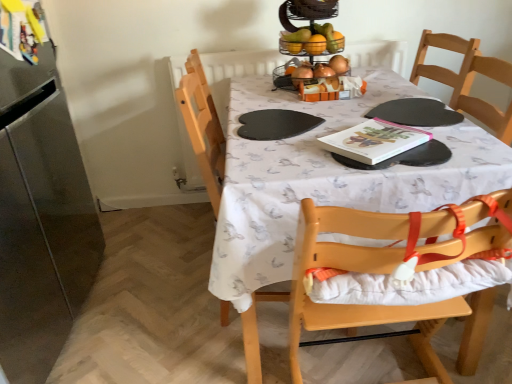
Question: Can you confirm if shiny metallic fruit basket at upper center is bigger than light wood highchair at center?

Choices:
 (A) yes
 (B) no

Answer: (B)

Question: Does shiny metallic fruit basket at upper center turn towards light wood highchair at center?

Choices:
 (A) yes
 (B) no

Answer: (B)

Question: Does shiny metallic fruit basket at upper center have a lesser height compared to light wood highchair at center?

Choices:
 (A) yes
 (B) no

Answer: (A)

Question: Is shiny metallic fruit basket at upper center behind light wood highchair at center?

Choices:
 (A) yes
 (B) no

Answer: (A)

Question: Is the depth of shiny metallic fruit basket at upper center less than that of light wood highchair at center?

Choices:
 (A) yes
 (B) no

Answer: (B)

Question: Is shiny metallic fruit basket at upper center oriented away from light wood highchair at center?

Choices:
 (A) yes
 (B) no

Answer: (B)

Question: Is stainless steel refrigerator at left further to camera compared to white printed tablecloth at center?

Choices:
 (A) no
 (B) yes

Answer: (A)

Question: From a real-world perspective, is stainless steel refrigerator at left over white printed tablecloth at center?

Choices:
 (A) yes
 (B) no

Answer: (A)

Question: Does stainless steel refrigerator at left appear on the right side of white printed tablecloth at center?

Choices:
 (A) no
 (B) yes

Answer: (A)

Question: Is stainless steel refrigerator at left thinner than white printed tablecloth at center?

Choices:
 (A) yes
 (B) no

Answer: (A)

Question: Considering the relative sizes of stainless steel refrigerator at left and white printed tablecloth at center in the image provided, is stainless steel refrigerator at left smaller than white printed tablecloth at center?

Choices:
 (A) yes
 (B) no

Answer: (A)

Question: From a real-world perspective, is stainless steel refrigerator at left physically below white printed tablecloth at center?

Choices:
 (A) yes
 (B) no

Answer: (B)

Question: Does white printed tablecloth at center have a lesser width compared to shiny metallic fruit basket at upper center?

Choices:
 (A) yes
 (B) no

Answer: (B)